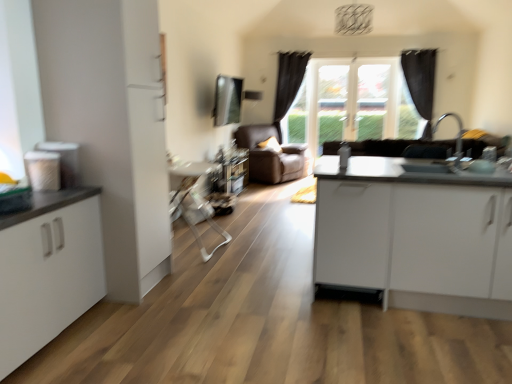
The image size is (512, 384). I want to click on vacant area to the right of white matte cabinet at left, so click(x=142, y=342).